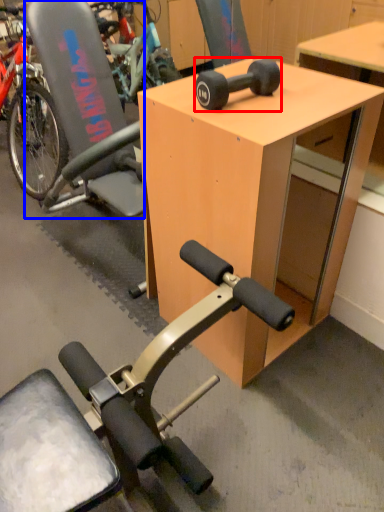
Question: Which point is closer to the camera, wheel (highlighted by a red box) or swivel chair (highlighted by a blue box)?

Choices:
 (A) wheel
 (B) swivel chair

Answer: (A)